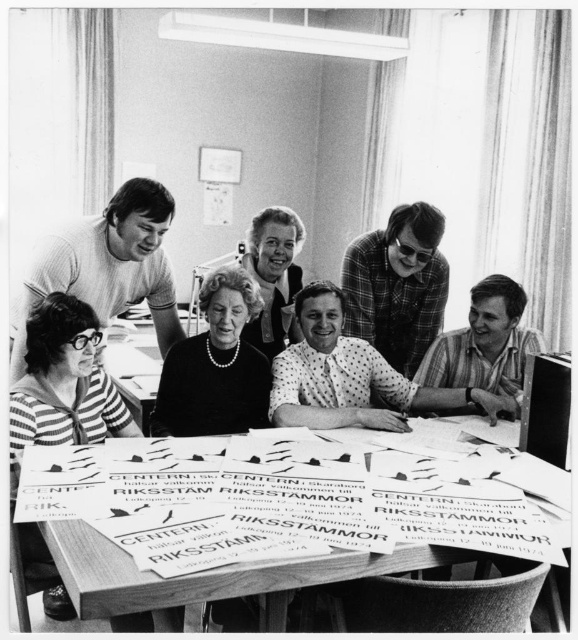
You are a fashion historian analyzing this 1970s photograph. You notice two central items of clothing, the polka dot blouse at center and the matte black dress at center. Which one is located to the right of the other?

The polka dot blouse at center is positioned on the right side of matte black dress at center.

In the scene shown: You are an appraiser examining this photograph and notice the black pearl necklace at center. Can you determine its exact position relative to the edges of the photograph?

The black pearl necklace at center is located at point coordinates of 0.589 along the horizontal axis and 0.607 along the vertical axis, meaning it is positioned slightly to the right and above the center of the photograph.